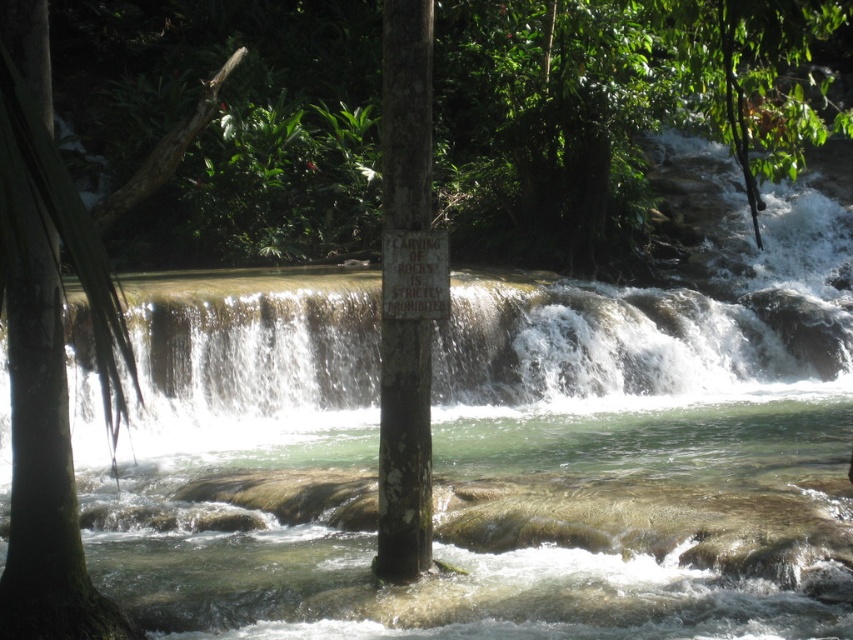
Is translucent white water at center behind green rough bark tree at left?

Yes.

Who is more forward, (x=225, y=332) or (x=39, y=301)?

Point (x=39, y=301)

Does point (337, 381) come in front of point (47, 29)?

No, it is not.

Find the location of a particular element. translucent white water at center is located at coordinates (631, 372).